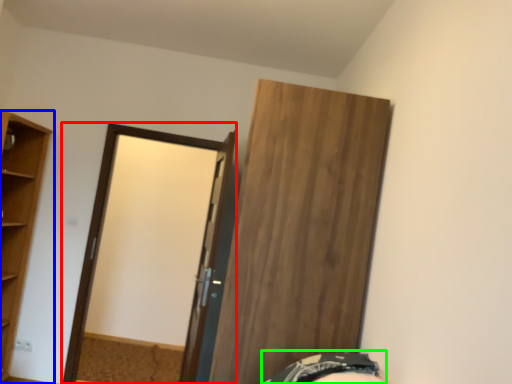
Question: Which is farther away from screen door (highlighted by a red box)? cupboard (highlighted by a blue box) or bed (highlighted by a green box)?

Choices:
 (A) cupboard
 (B) bed

Answer: (B)